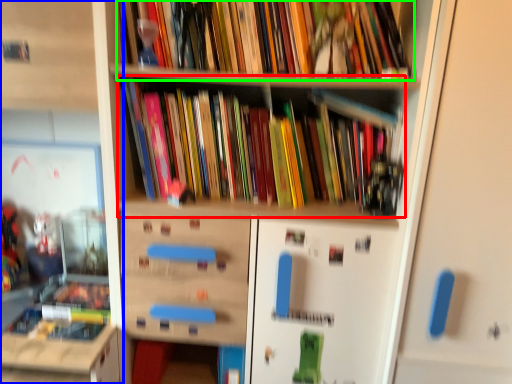
Question: Which object is the closest to the book (highlighted by a red box)? Choose among these: shelf (highlighted by a blue box) or book (highlighted by a green box).

Choices:
 (A) shelf
 (B) book

Answer: (B)